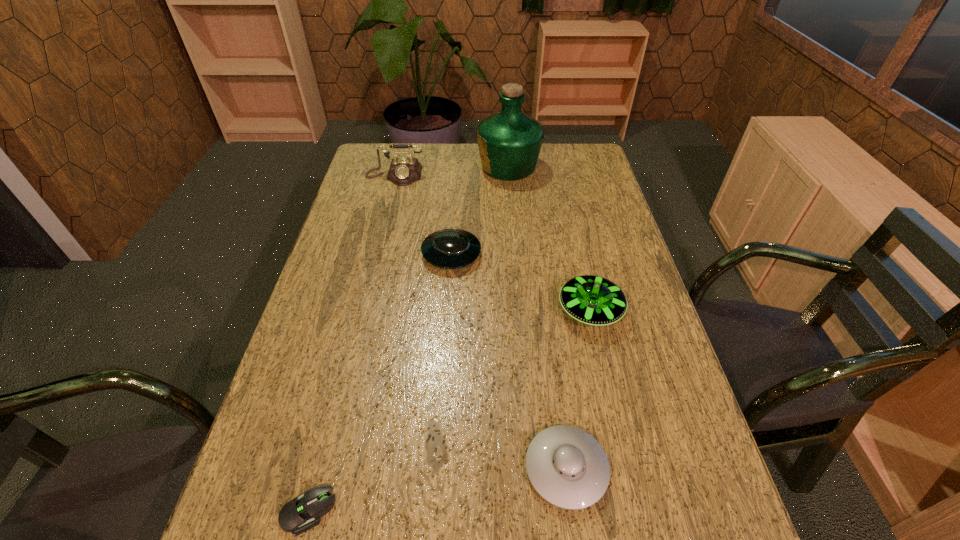
You are a GUI agent. You are given a task and a screenshot of the screen. Output one action in this format:
    pyautogui.click(x=<x>, y=<y>)
    Task: Click on the free space that satisfies the following two spatial constraints: 1. on the dial of the leftmost saucer; 2. on the left side of the telephone
    The image size is (960, 540).
    Given the screenshot: What is the action you would take?
    pyautogui.click(x=375, y=254)

This screenshot has height=540, width=960. In order to click on vacant area in the image that satisfies the following two spatial constraints: 1. on the dial of the second tallest object; 2. on the right side of the fourth shortest object in this screenshot , I will do `click(361, 310)`.

This screenshot has height=540, width=960. Find the location of `vacant space that satisfies the following two spatial constraints: 1. on the back side of the nearest saucer; 2. on the left side of the third nearest object`. vacant space that satisfies the following two spatial constraints: 1. on the back side of the nearest saucer; 2. on the left side of the third nearest object is located at coordinates (544, 310).

I want to click on vacant area in the image that satisfies the following two spatial constraints: 1. on the label side of the tallest object; 2. on the back side of the third tallest object, so tap(520, 310).

Find the location of a particular element. free space that satisfies the following two spatial constraints: 1. on the label side of the liquor; 2. on the back side of the fourth shortest object is located at coordinates click(x=520, y=310).

At what (x,y) coordinates should I click in order to perform the action: click on vacant space that satisfies the following two spatial constraints: 1. on the back side of the shortest object; 2. on the right side of the nearest saucer. Please return your answer as a coordinate pair (x, y). The width and height of the screenshot is (960, 540). Looking at the image, I should click on (320, 469).

Where is `vacant space that satisfies the following two spatial constraints: 1. on the front side of the fourth shortest object; 2. on the left side of the third farthest object`? vacant space that satisfies the following two spatial constraints: 1. on the front side of the fourth shortest object; 2. on the left side of the third farthest object is located at coordinates (447, 310).

The image size is (960, 540). What are the coordinates of `vacant area in the image that satisfies the following two spatial constraints: 1. on the front side of the fourth farthest object; 2. on the right side of the third farthest object` in the screenshot? It's located at (447, 310).